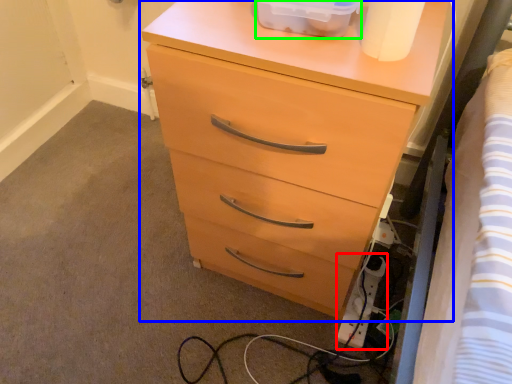
Question: Estimate the real-world distances between objects in this image. Which object is closer to extension cord (highlighted by a red box), chest of drawers (highlighted by a blue box) or storage box (highlighted by a green box)?

Choices:
 (A) chest of drawers
 (B) storage box

Answer: (A)